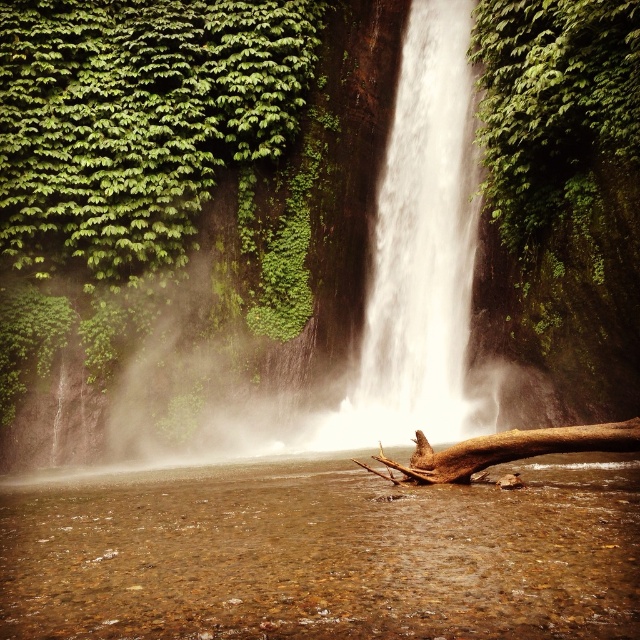
Question: Which point is closer to the camera taking this photo?

Choices:
 (A) (460, 113)
 (B) (420, 472)
 (C) (90, 545)

Answer: (C)

Question: Can you confirm if brown textured water at center is thinner than brown rough tree trunk at lower center?

Choices:
 (A) yes
 (B) no

Answer: (B)

Question: Does green leafy tree at upper left appear over white smooth waterfall at center?

Choices:
 (A) no
 (B) yes

Answer: (B)

Question: Which object is positioned farthest from the green leafy tree at upper left?

Choices:
 (A) brown textured water at center
 (B) brown rough tree trunk at lower center

Answer: (B)

Question: Is brown textured water at center wider than white smooth waterfall at center?

Choices:
 (A) no
 (B) yes

Answer: (B)

Question: Which of the following is the closest to the observer?

Choices:
 (A) (150, 246)
 (B) (442, 468)
 (C) (422, 412)

Answer: (B)